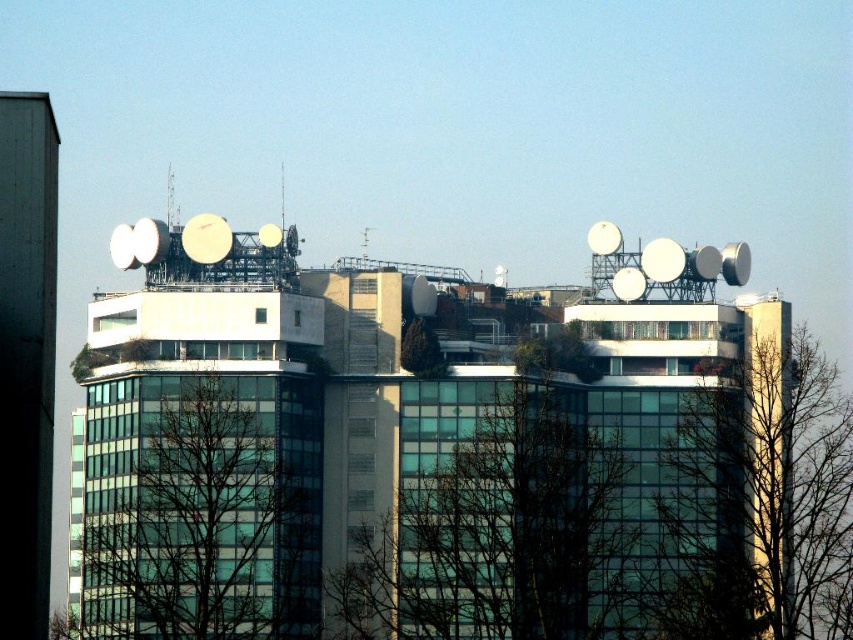
Question: Among these objects, which one is farthest from the camera?

Choices:
 (A) green leafless tree at left
 (B) green leafy tree at right

Answer: (B)

Question: Considering the relative positions of green leafless tree at left and green leafy tree at right in the image provided, where is green leafless tree at left located with respect to green leafy tree at right?

Choices:
 (A) left
 (B) right

Answer: (A)

Question: Which point appears closest to the camera in this image?

Choices:
 (A) (538, 596)
 (B) (210, 467)

Answer: (B)

Question: Among these objects, which one is nearest to the camera?

Choices:
 (A) green leafy tree at center
 (B) green leafy tree at right

Answer: (B)

Question: Is green leafless tree at left further to camera compared to green leafy tree at right?

Choices:
 (A) yes
 (B) no

Answer: (B)

Question: Does green leafy tree at center appear on the right side of green leafy tree at right?

Choices:
 (A) no
 (B) yes

Answer: (A)